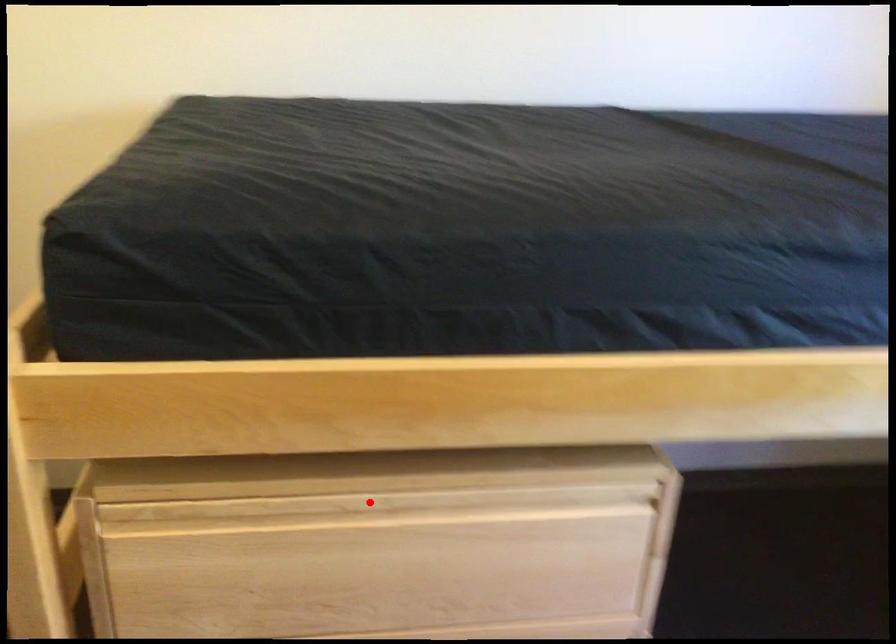
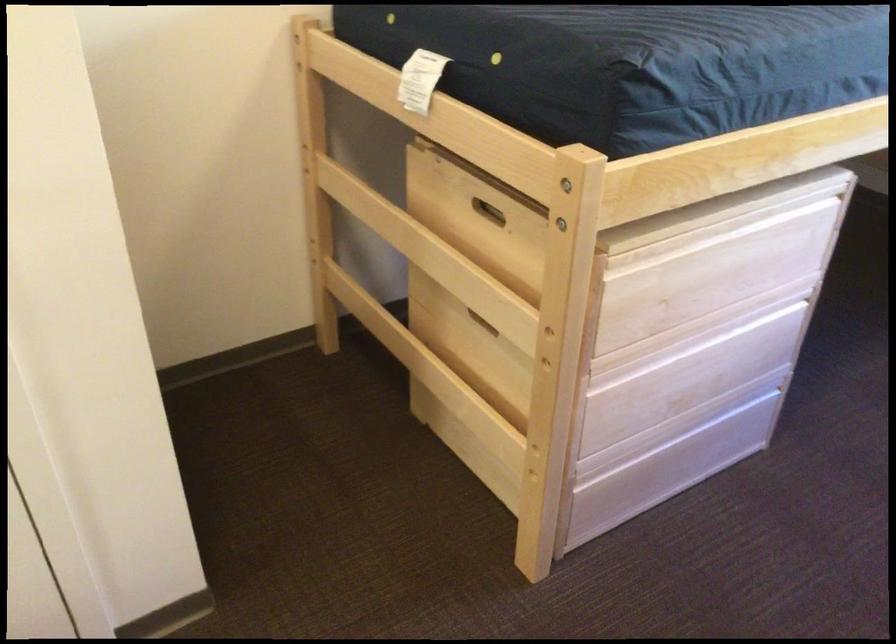
In the second image, find the point that corresponds to the highlighted location in the first image.

(720, 230)